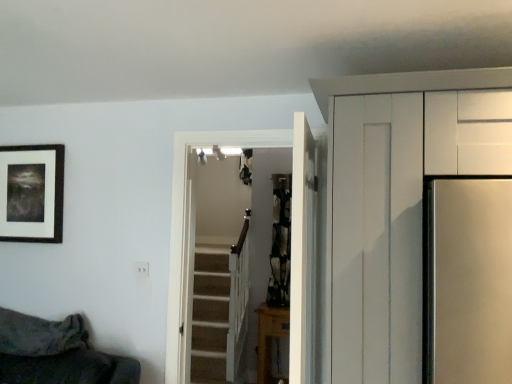
Question: From a real-world perspective, relative to white wooden door at center, the 1th door viewed from the front, is white wooden door at center, acting as the first door starting from the back, vertically above or below?

Choices:
 (A) above
 (B) below

Answer: (B)

Question: Looking at their shapes, would you say white wooden door at center, the second door from the front, is wider or thinner than white wooden door at center, the 1th door viewed from the front?

Choices:
 (A) wide
 (B) thin

Answer: (A)

Question: Considering the real-world distances, which object is farthest from the black matte picture frame at upper left?

Choices:
 (A) white wooden door at center, the second door when ordered from back to front
 (B) wooden table at lower center
 (C) white wooden door at center, the second door from the front

Answer: (B)

Question: Considering the real-world distances, which object is farthest from the white wooden door at center, the 1th door viewed from the front?

Choices:
 (A) white wooden door at center, the second door from the front
 (B) wooden table at lower center
 (C) black matte picture frame at upper left

Answer: (B)